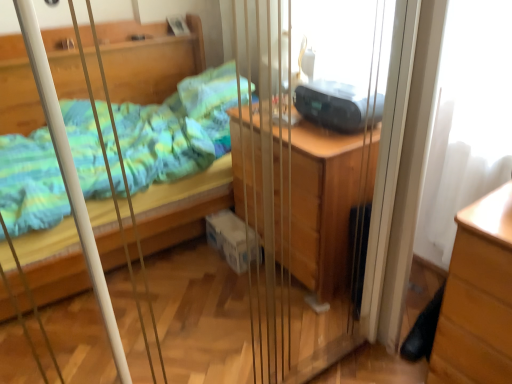
Describe the element at coordinates (478, 297) in the screenshot. This screenshot has height=384, width=512. I see `light brown wood chest of drawers at lower right` at that location.

What is the approximate height of light brown wood chest of drawers at lower right?

light brown wood chest of drawers at lower right is 26.50 inches tall.

At what (x,y) coordinates should I click in order to perform the action: click on light brown wood chest of drawers at lower right. Please return your answer as a coordinate pair (x, y). The height and width of the screenshot is (384, 512). Looking at the image, I should click on (478, 297).

Describe the element at coordinates (332, 105) in the screenshot. The image size is (512, 384). I see `black plastic radio at upper right` at that location.

In order to click on black plastic radio at upper right in this screenshot , I will do `click(332, 105)`.

Where is `light brown wood chest of drawers at lower right`? Image resolution: width=512 pixels, height=384 pixels. light brown wood chest of drawers at lower right is located at coordinates (478, 297).

Consider the image. Is light brown wood chest of drawers at lower right at the right side of black plastic radio at upper right?

Indeed, light brown wood chest of drawers at lower right is positioned on the right side of black plastic radio at upper right.

Which object is closer to the camera taking this photo, light brown wood chest of drawers at lower right or black plastic radio at upper right?

light brown wood chest of drawers at lower right.

Does point (434, 366) appear closer or farther from the camera than point (357, 124)?

Point (434, 366) is closer to the camera than point (357, 124).

From the image's perspective, relative to black plastic radio at upper right, is light brown wood chest of drawers at lower right above or below?

From the image's perspective, light brown wood chest of drawers at lower right appears below black plastic radio at upper right.

From a real-world perspective, does light brown wood chest of drawers at lower right stand above black plastic radio at upper right?

No, from a real-world perspective, light brown wood chest of drawers at lower right is not above black plastic radio at upper right.

Is light brown wood chest of drawers at lower right wider than black plastic radio at upper right?

Indeed, light brown wood chest of drawers at lower right has a greater width compared to black plastic radio at upper right.

Considering the sizes of objects light brown wood chest of drawers at lower right and black plastic radio at upper right in the image provided, who is shorter, light brown wood chest of drawers at lower right or black plastic radio at upper right?

Standing shorter between the two is black plastic radio at upper right.

Considering the sizes of light brown wood chest of drawers at lower right and black plastic radio at upper right in the image, is light brown wood chest of drawers at lower right bigger or smaller than black plastic radio at upper right?

light brown wood chest of drawers at lower right is bigger than black plastic radio at upper right.

Is black plastic radio at upper right completely or partially inside light brown wood chest of drawers at lower right?

No.

Is light brown wood chest of drawers at lower right not close to black plastic radio at upper right?

light brown wood chest of drawers at lower right is actually quite close to black plastic radio at upper right.

Is light brown wood chest of drawers at lower right facing away from black plastic radio at upper right?

light brown wood chest of drawers at lower right is not turned away from black plastic radio at upper right.

How many degrees apart are the facing directions of light brown wood chest of drawers at lower right and black plastic radio at upper right?

88.7 degrees.

How much distance is there between light brown wood chest of drawers at lower right and black plastic radio at upper right?

The distance of light brown wood chest of drawers at lower right from black plastic radio at upper right is 22.79 inches.

Find the location of a particular element. The height and width of the screenshot is (384, 512). chest of drawers below the black plastic radio at upper right (from a real-world perspective) is located at coordinates (478, 297).

Is black plastic radio at upper right to the left or to the right of light brown wood chest of drawers at lower right in the image?

Based on their positions, black plastic radio at upper right is located to the left of light brown wood chest of drawers at lower right.

In the image, is black plastic radio at upper right positioned in front of or behind light brown wood chest of drawers at lower right?

black plastic radio at upper right is behind light brown wood chest of drawers at lower right.

Does point (338, 97) lie behind point (446, 333)?

Yes.

From the image's perspective, is black plastic radio at upper right positioned above or below light brown wood chest of drawers at lower right?

Clearly, from the image's perspective, black plastic radio at upper right is above light brown wood chest of drawers at lower right.

From a real-world perspective, which object rests below the other?

In real-world perspective, light brown wood chest of drawers at lower right is lower.

Between black plastic radio at upper right and light brown wood chest of drawers at lower right, which one has larger width?

light brown wood chest of drawers at lower right is wider.

Considering the sizes of objects black plastic radio at upper right and light brown wood chest of drawers at lower right in the image provided, who is taller, black plastic radio at upper right or light brown wood chest of drawers at lower right?

With more height is light brown wood chest of drawers at lower right.

Does black plastic radio at upper right have a smaller size compared to light brown wood chest of drawers at lower right?

Indeed, black plastic radio at upper right has a smaller size compared to light brown wood chest of drawers at lower right.

Is black plastic radio at upper right inside or outside of light brown wood chest of drawers at lower right?

The correct answer is: outside.

Is black plastic radio at upper right with light brown wood chest of drawers at lower right?

No, black plastic radio at upper right is not making contact with light brown wood chest of drawers at lower right.

Could you tell me if black plastic radio at upper right is facing light brown wood chest of drawers at lower right?

No.

What's the angular difference between black plastic radio at upper right and light brown wood chest of drawers at lower right's facing directions?

black plastic radio at upper right and light brown wood chest of drawers at lower right are facing 88.7 degrees away from each other.

Consider the image. Measure the distance from black plastic radio at upper right to light brown wood chest of drawers at lower right.

black plastic radio at upper right is 22.79 inches from light brown wood chest of drawers at lower right.

There is a light brown wood chest of drawers at lower right. Find the location of `equipment above it (from a real-world perspective)`. equipment above it (from a real-world perspective) is located at coordinates (332, 105).

The width and height of the screenshot is (512, 384). I want to click on the chest of drawers that appears in front of the black plastic radio at upper right, so click(478, 297).

Where is `the chest of drawers that appears below the black plastic radio at upper right (from a real-world perspective)`? the chest of drawers that appears below the black plastic radio at upper right (from a real-world perspective) is located at coordinates (478, 297).